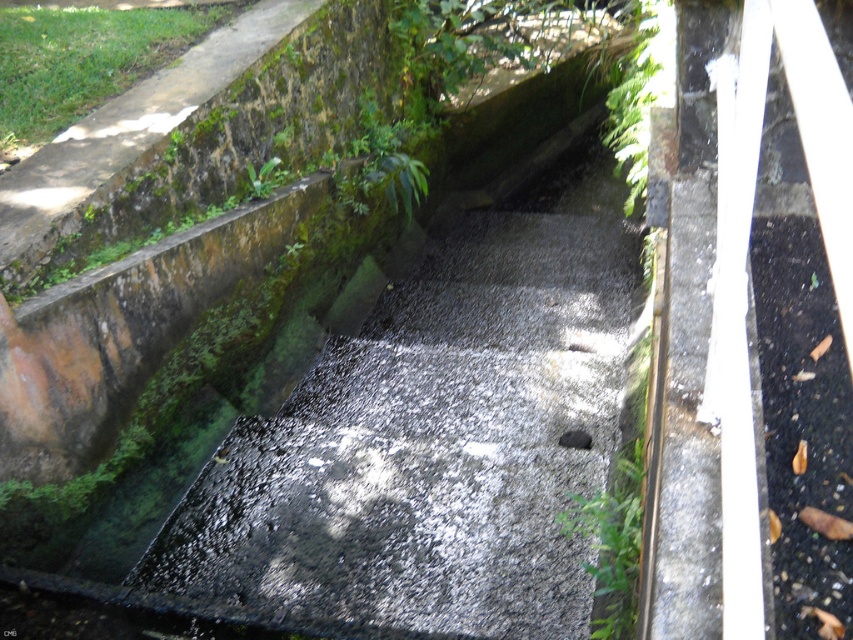
Is gray concrete at center to the left of black concrete drain at center from the viewer's perspective?

Indeed, gray concrete at center is positioned on the left side of black concrete drain at center.

Between gray concrete at center and black concrete drain at center, which one has more height?

Standing taller between the two is gray concrete at center.

Identify the location of gray concrete at center. This screenshot has height=640, width=853. (434, 436).